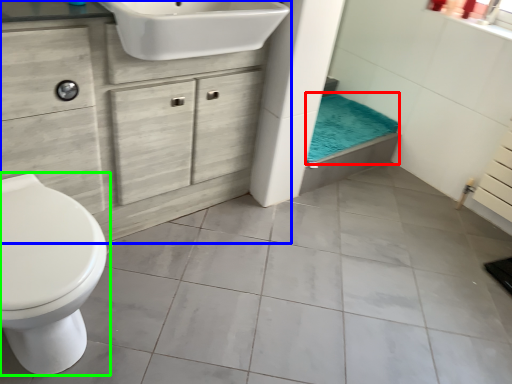
Question: Considering the real-world distances, which object is farthest from bath towel (highlighted by a red box)? bathroom cabinet (highlighted by a blue box) or toilet (highlighted by a green box)?

Choices:
 (A) bathroom cabinet
 (B) toilet

Answer: (B)